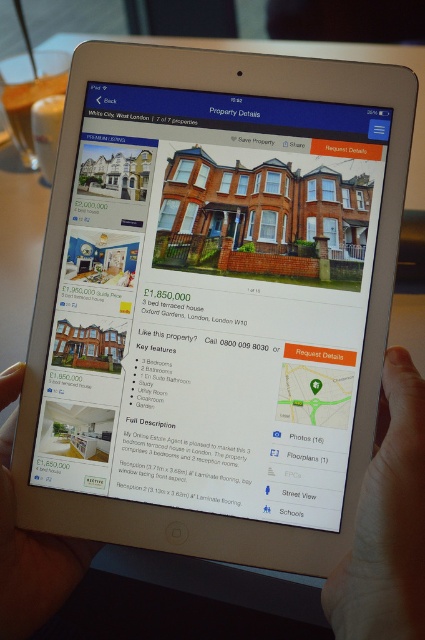
Question: Considering the real-world distances, which object is farthest from the skinny white tablet at center?

Choices:
 (A) skin tone flesh hand at lower right
 (B) matte black hand at lower left

Answer: (B)

Question: Is skin tone flesh hand at lower right closer to the viewer compared to matte black hand at lower left?

Choices:
 (A) no
 (B) yes

Answer: (B)

Question: Which point is farther from the camera taking this photo?

Choices:
 (A) (411, 406)
 (B) (399, 580)
 (C) (20, 593)

Answer: (C)

Question: Is skinny white tablet at center positioned before skin tone flesh hand at lower right?

Choices:
 (A) no
 (B) yes

Answer: (A)

Question: Is skin tone flesh hand at lower right behind matte black hand at lower left?

Choices:
 (A) no
 (B) yes

Answer: (A)

Question: Which point appears farthest from the camera in this image?

Choices:
 (A) (19, 600)
 (B) (393, 538)
 (C) (379, 451)

Answer: (A)